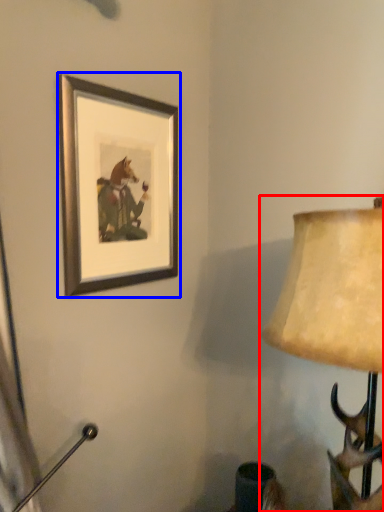
Question: Which object appears farthest to the camera in this image, lamp (highlighted by a red box) or picture frame (highlighted by a blue box)?

Choices:
 (A) lamp
 (B) picture frame

Answer: (B)